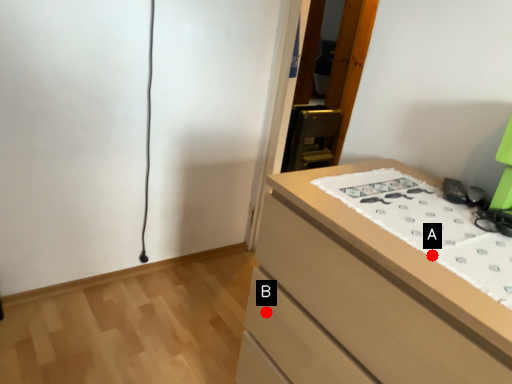
Question: Two points are circled on the image, labeled by A and B beside each circle. Which point is further to the camera?

Choices:
 (A) A is further
 (B) B is further

Answer: (B)